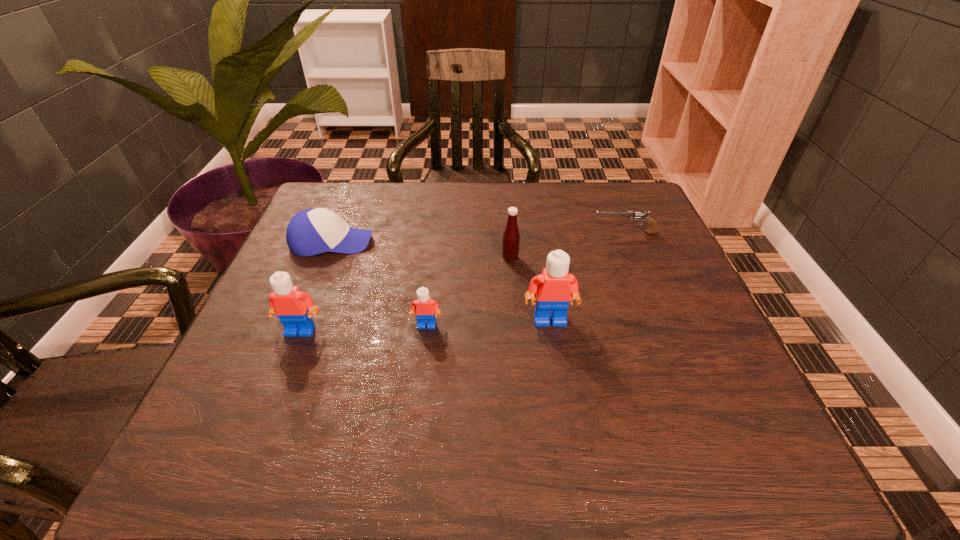
Image resolution: width=960 pixels, height=540 pixels. Identify the location of object that is at the far left corner. (310, 232).

Locate an element on the screen. vacant space at the far edge of the desktop is located at coordinates (438, 212).

The height and width of the screenshot is (540, 960). In the image, there is a desktop. Identify the location of free region at the near edge. (407, 413).

Locate an element on the screen. This screenshot has width=960, height=540. free point at the left edge is located at coordinates (344, 276).

This screenshot has width=960, height=540. In the image, there is a desktop. Find the location of `vacant space at the right edge`. vacant space at the right edge is located at coordinates (651, 310).

This screenshot has height=540, width=960. In the image, there is a desktop. Identify the location of vacant space at the far left corner. (374, 193).

Find the location of a particular element. The width and height of the screenshot is (960, 540). vacant space at the near left corner of the desktop is located at coordinates (266, 393).

In the image, there is a desktop. Where is `vacant area at the far right corner`? This screenshot has height=540, width=960. vacant area at the far right corner is located at coordinates click(x=603, y=200).

You are a GUI agent. You are given a task and a screenshot of the screen. Output one action in this format:
    pyautogui.click(x=<x>, y=<y>)
    Task: Click on the vacant space at the near right corner of the desktop
    
    Given the screenshot: What is the action you would take?
    pyautogui.click(x=663, y=381)

Identify the location of blank region between the second Lego from right to left and the baseball cap. 379,284.